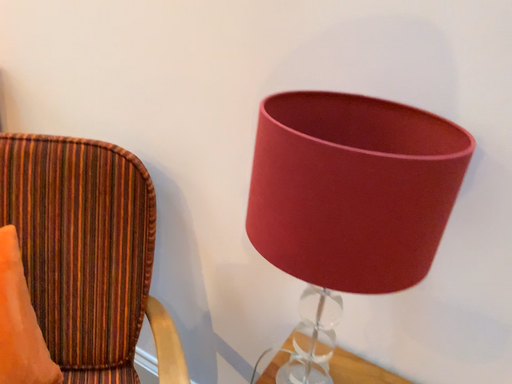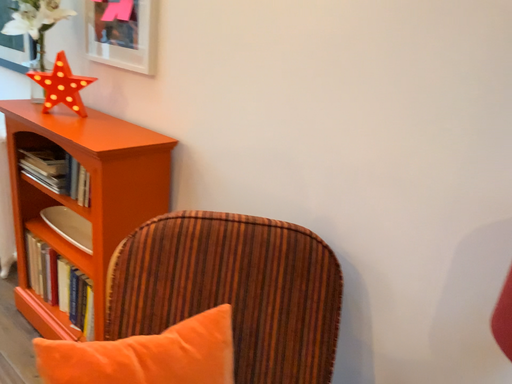
Question: Which way did the camera rotate in the video?

Choices:
 (A) rotated upward
 (B) rotated downward

Answer: (A)